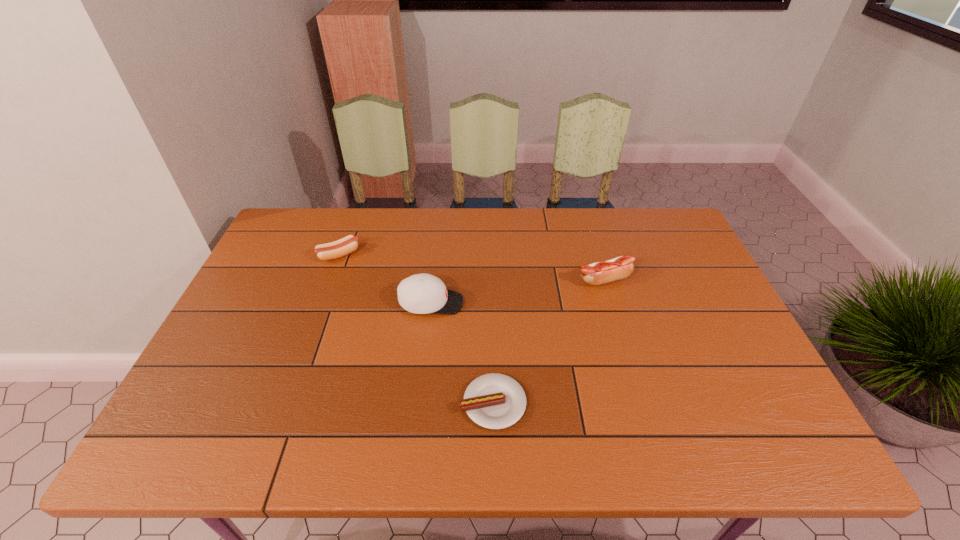
Where is `free space located 0.050m on the right of the shortest sausage`? Image resolution: width=960 pixels, height=540 pixels. free space located 0.050m on the right of the shortest sausage is located at coordinates (548, 403).

Where is `object that is at the far edge`? The image size is (960, 540). object that is at the far edge is located at coordinates (348, 244).

The height and width of the screenshot is (540, 960). Identify the location of object that is at the near edge. (495, 401).

In the image, there is a desktop. Where is `free space at the far edge`? This screenshot has height=540, width=960. free space at the far edge is located at coordinates (455, 235).

Locate an element on the screen. The width and height of the screenshot is (960, 540). vacant space at the near edge is located at coordinates (521, 453).

This screenshot has height=540, width=960. I want to click on vacant space at the left edge of the desktop, so click(309, 254).

Image resolution: width=960 pixels, height=540 pixels. I want to click on vacant space at the right edge of the desktop, so click(x=699, y=330).

What are the coordinates of `vacant space at the near left corner` in the screenshot? It's located at (198, 457).

Identify the location of free region at the far right corner of the desktop. (675, 226).

Where is `free point between the shortest object and the rightmost sausage`? This screenshot has width=960, height=540. free point between the shortest object and the rightmost sausage is located at coordinates (548, 341).